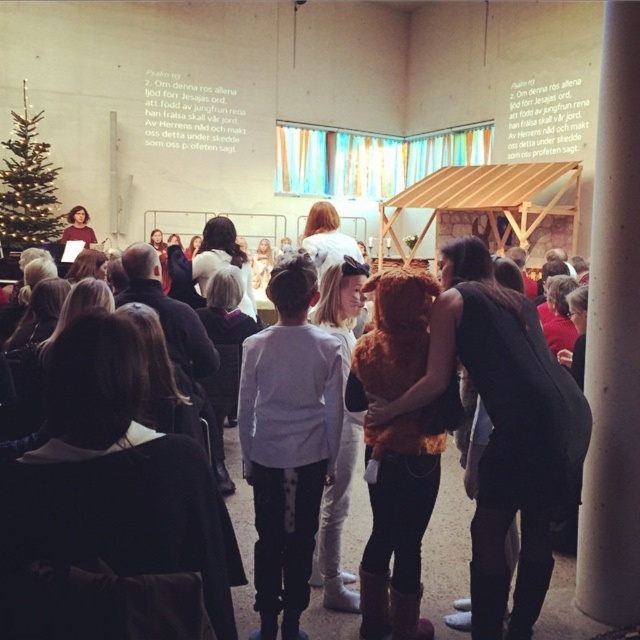
From the picture: You are a photographer taking a picture of the nativity scene. You notice two elements at the center of the image, the dark brown hair at center and the brown furry costume at center. Which one is closer to the camera?

The dark brown hair at center is positioned over the brown furry costume at center, meaning it is closer to the camera.

You are a photographer standing at the back of the room. You want to take a photo of both the white soft sweater at center and the brown furry coat at center without any obstruction. Given that your camera has a maximum focus range of 15 inches, can you capture both items clearly in the same photo?

The distance between the white soft sweater at center and the brown furry coat at center is 17.29 inches, which exceeds the camera maximum focus range of 15 inches. Therefore, you cannot capture both items clearly in the same photo.

You are a photographer who wants to capture a photo of the nativity scene without any people blocking it. You see two coats hanging on a rack in the center of the room. Which coat should you move first to clear the view? The white soft sweater at center or the brown furry coat at center?

The white soft sweater at center is positioned on the left side of brown furry coat at center. Since the photographer needs to clear the view, moving the white soft sweater at center first would allow access to the brown furry coat at center, ensuring both are moved out of the way efficiently.